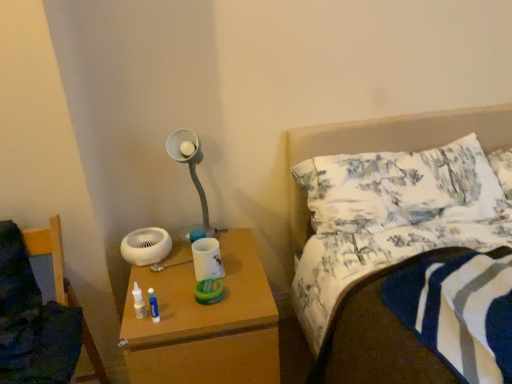
Identify the location of free point above wooden nightstand at lower center (from a real-world perspective). This screenshot has height=384, width=512. coord(181,288).